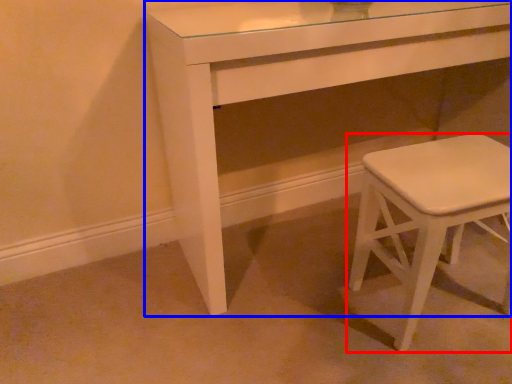
Question: Which object is closer to the camera taking this photo, stool (highlighted by a red box) or table (highlighted by a blue box)?

Choices:
 (A) stool
 (B) table

Answer: (B)